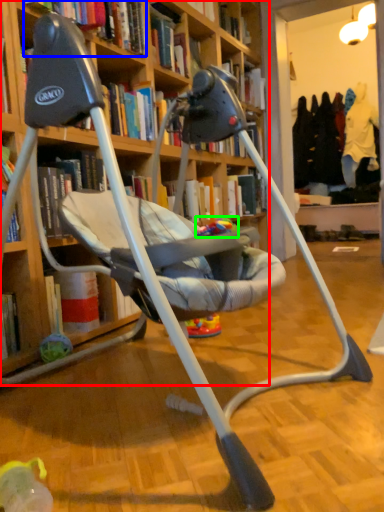
Question: Which object is positioned closest to bookcase (highlighted by a red box)? Select from book (highlighted by a blue box) and toy (highlighted by a green box).

Choices:
 (A) book
 (B) toy

Answer: (B)